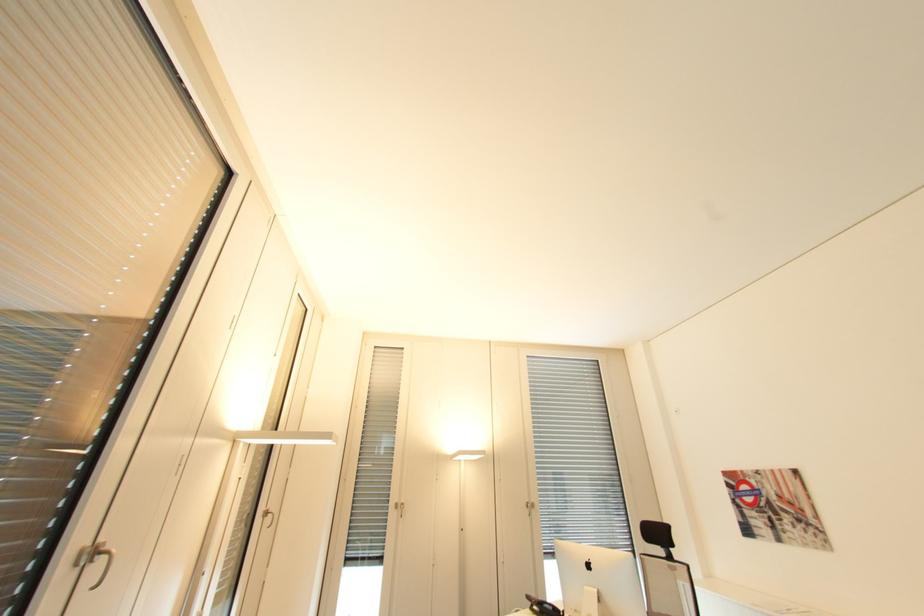
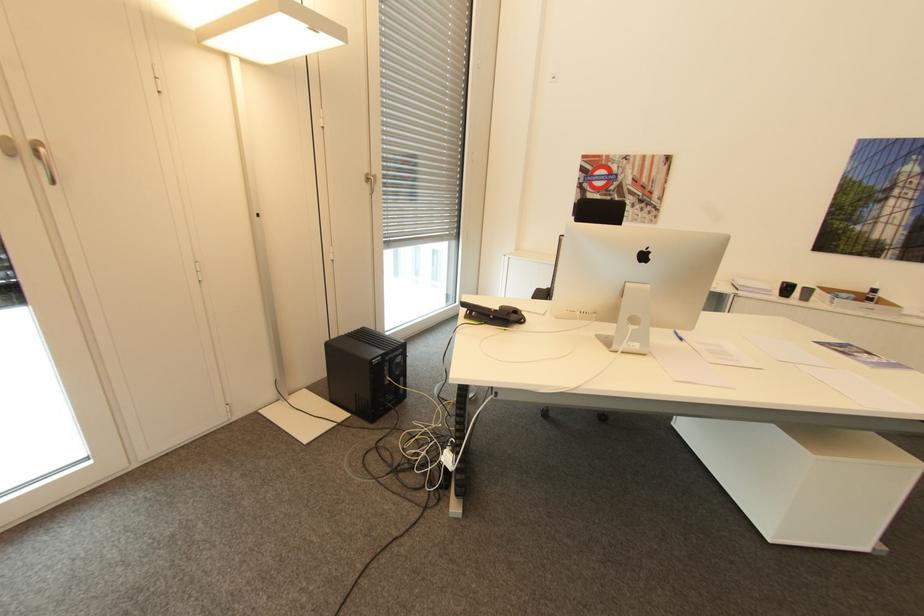
Locate, in the second image, the point that corresponds to point 407,503 in the first image.

(43, 144)